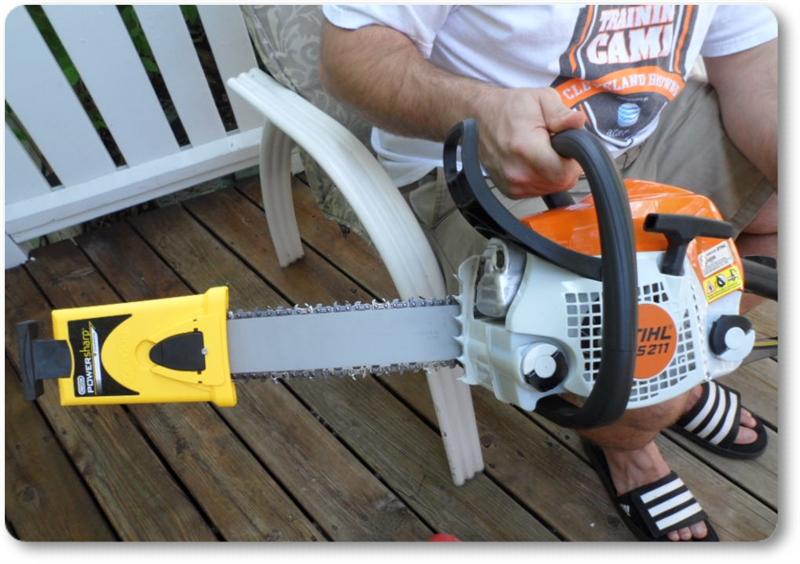
This screenshot has width=800, height=564. Find the location of `pair of slippers`. pair of slippers is located at coordinates (660, 502), (713, 424).